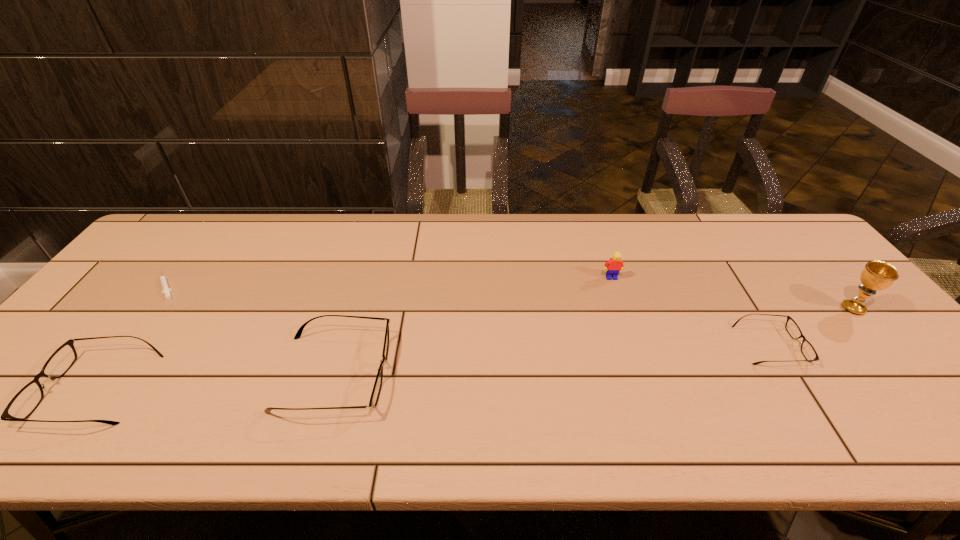
Identify the location of object that is at the near left corner. (23, 404).

Identify the location of vacant space at the far edge of the desktop. (600, 227).

Where is `free spot at the near edge of the desktop`? This screenshot has width=960, height=540. free spot at the near edge of the desktop is located at coordinates (213, 400).

At what (x,y) coordinates should I click in order to perform the action: click on vacant space at the left edge of the desktop. Please return your answer as a coordinate pair (x, y). The width and height of the screenshot is (960, 540). Looking at the image, I should click on [106, 309].

The height and width of the screenshot is (540, 960). Identify the location of blank space at the far right corner of the desktop. coord(753,215).

This screenshot has height=540, width=960. I want to click on vacant space at the near right corner of the desktop, so click(x=898, y=402).

This screenshot has height=540, width=960. Find the location of `empty space between the shortest object and the chalice`. empty space between the shortest object and the chalice is located at coordinates (510, 298).

Locate an element on the screen. The image size is (960, 540). free point between the second tallest spectacles and the second spectacles from right to left is located at coordinates pos(215,381).

This screenshot has height=540, width=960. I want to click on empty location between the syringe and the second tallest object, so click(x=389, y=282).

In order to click on free space between the fourth object from left to right and the shortest object in this screenshot , I will do click(389, 282).